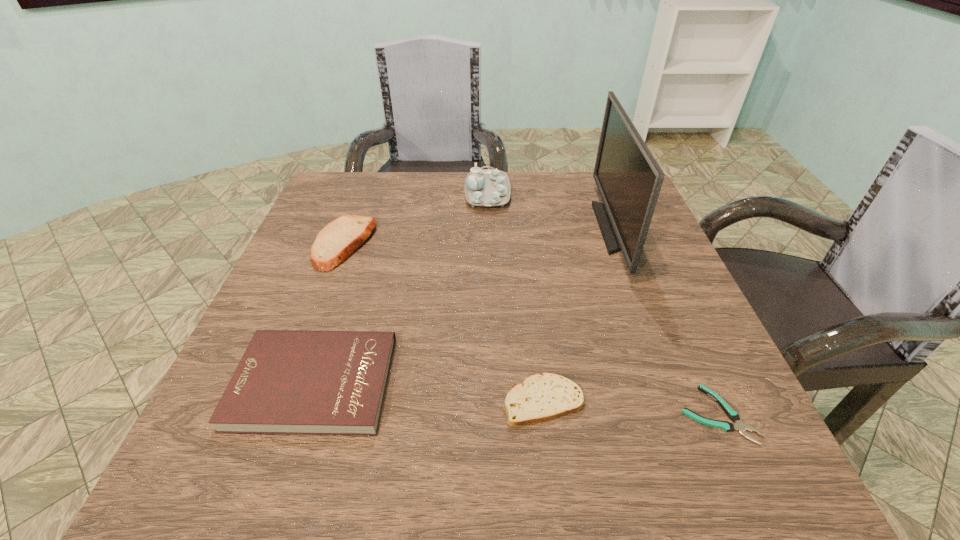
You are a GUI agent. You are given a task and a screenshot of the screen. Output one action in this format:
    pyautogui.click(x=<x>, y=<y>)
    Task: Click on the monitor
    The width and height of the screenshot is (960, 540).
    Given the screenshot: What is the action you would take?
    pyautogui.click(x=629, y=179)

The width and height of the screenshot is (960, 540). In order to click on the second tallest object in this screenshot , I will do `click(487, 188)`.

Image resolution: width=960 pixels, height=540 pixels. I want to click on the left pita bread, so click(340, 238).

At what (x,y) coordinates should I click in order to perform the action: click on the taller pita bread. Please return your answer as a coordinate pair (x, y). This screenshot has width=960, height=540. Looking at the image, I should click on (340, 238).

This screenshot has width=960, height=540. Identify the location of the fourth tallest object. (306, 382).

Locate an element on the screen. The image size is (960, 540). the right pita bread is located at coordinates (538, 398).

Identify the location of the nearer pita bread. (538, 398).

The width and height of the screenshot is (960, 540). In order to click on the shortest object in this screenshot , I will do `click(733, 415)`.

Locate an element on the screen. The width and height of the screenshot is (960, 540). free space located on the screen side of the tallest object is located at coordinates (538, 228).

Where is `blank area located on the screen side of the tallest object`? Image resolution: width=960 pixels, height=540 pixels. blank area located on the screen side of the tallest object is located at coordinates click(471, 228).